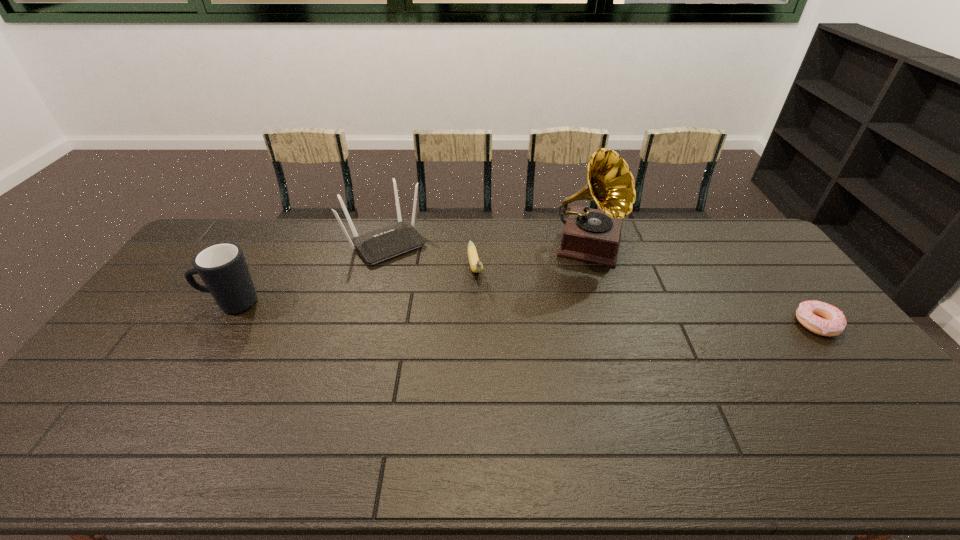
Find the location of `blank region between the second object from left to right and the third object from right to left`. blank region between the second object from left to right and the third object from right to left is located at coordinates (430, 255).

Where is `free space between the banana and the doughnut`? free space between the banana and the doughnut is located at coordinates (646, 296).

At what (x,y) coordinates should I click in order to perform the action: click on empty space between the router and the banana. Please return your answer as a coordinate pair (x, y). The image size is (960, 540). Looking at the image, I should click on (430, 255).

You are a GUI agent. You are given a task and a screenshot of the screen. Output one action in this format:
    pyautogui.click(x=<x>, y=<y>)
    Task: Click on the unoccupied area between the second object from right to left and the shortest object
    Image resolution: width=960 pixels, height=540 pixels.
    Given the screenshot: What is the action you would take?
    pyautogui.click(x=703, y=285)

Locate an element on the screen. The height and width of the screenshot is (540, 960). vacant area that lies between the second object from left to right and the tallest object is located at coordinates (488, 244).

Where is `blank region between the third object from right to left and the doughnut`? blank region between the third object from right to left and the doughnut is located at coordinates (646, 296).

The image size is (960, 540). What are the coordinates of `free spot between the banana and the router` in the screenshot? It's located at (430, 255).

Point out which object is positioned as the nearest to the router. Please provide its 2D coordinates. Your answer should be formatted as a tuple, i.e. [(x, y)], where the tuple contains the x and y coordinates of a point satisfying the conditions above.

[(476, 265)]

I want to click on object that is the closest one to the rightmost object, so click(x=592, y=235).

At what (x,y) coordinates should I click in order to perform the action: click on vacant space that satisfies the following two spatial constraints: 1. on the front side of the doughnut; 2. on the left side of the third object from right to left. Please return your answer as a coordinate pair (x, y). Looking at the image, I should click on (474, 323).